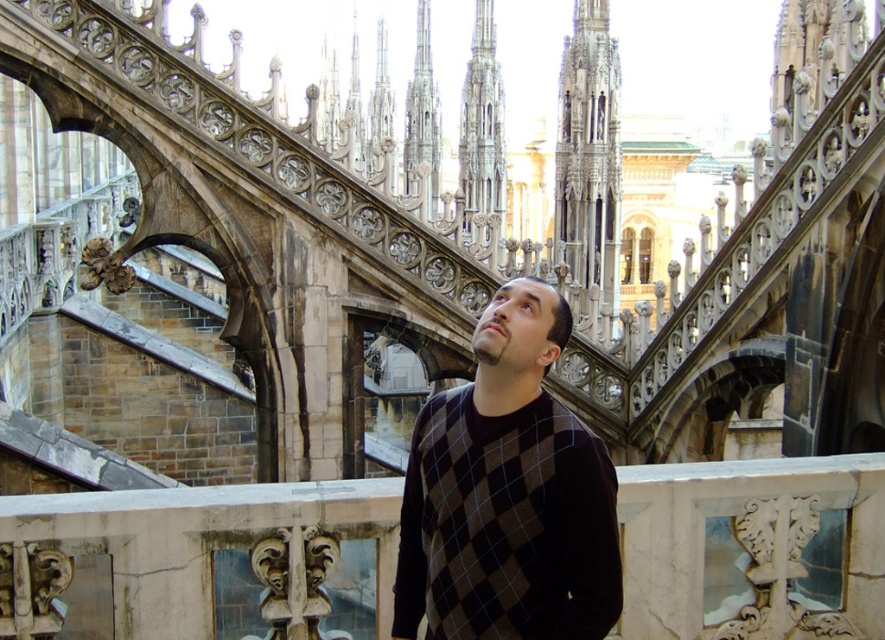
From the picture: You are standing at the point marked as point (491, 420) in the image. The cathedral structure is behind you. If you walk straight ahead, will you eventually reach the cathedral structure or move away from it?

Since the distance of point (491, 420) from camera is 97.02 feet, walking straight ahead from point (491, 420) would move you away from the cathedral structure because the point is already positioned between you and the cathedral.

You are a photographer trying to capture the dark brown sweater at center in the image. The camera is positioned at point A, and you need to adjust the zoom level to ensure the sweater is in focus. Based on the coordinates provided, what is the best zoom level to use?

The dark brown sweater at center is located at coordinates point A, so you should set the zoom level to 50mm to ensure it is in focus.

You are a tour guide explaining the historical building to a group. You point to the dark brown sweater at center and the gray stone spire at upper center. Which object is closer to the visitors standing in front of the building?

The dark brown sweater at center is closer to the visitors because it is in front of the gray stone spire at upper center.